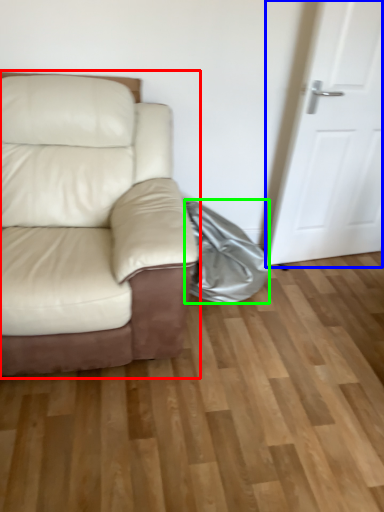
Question: Based on their relative distances, which object is nearer to studio couch (highlighted by a red box)? Choose from door (highlighted by a blue box) and material (highlighted by a green box).

Choices:
 (A) door
 (B) material

Answer: (B)